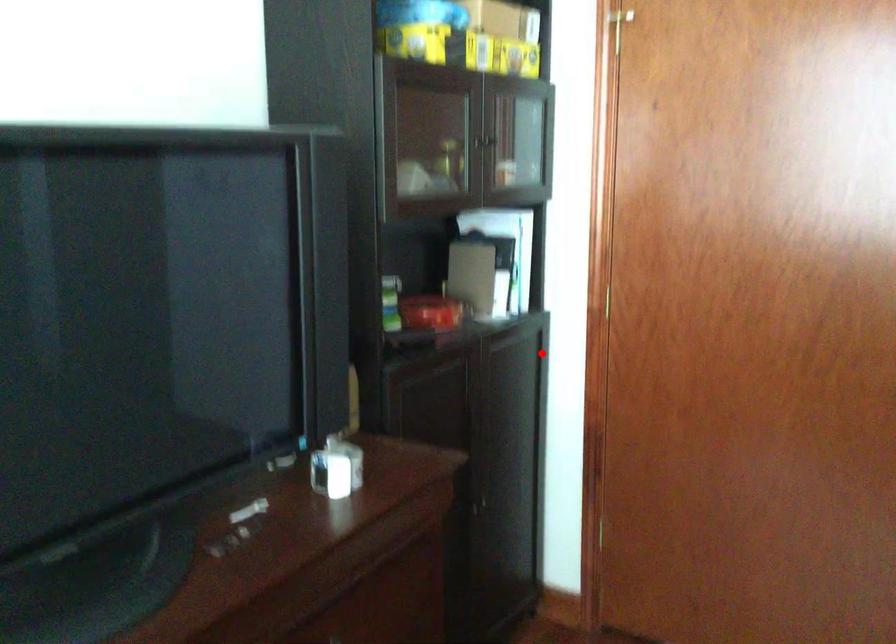
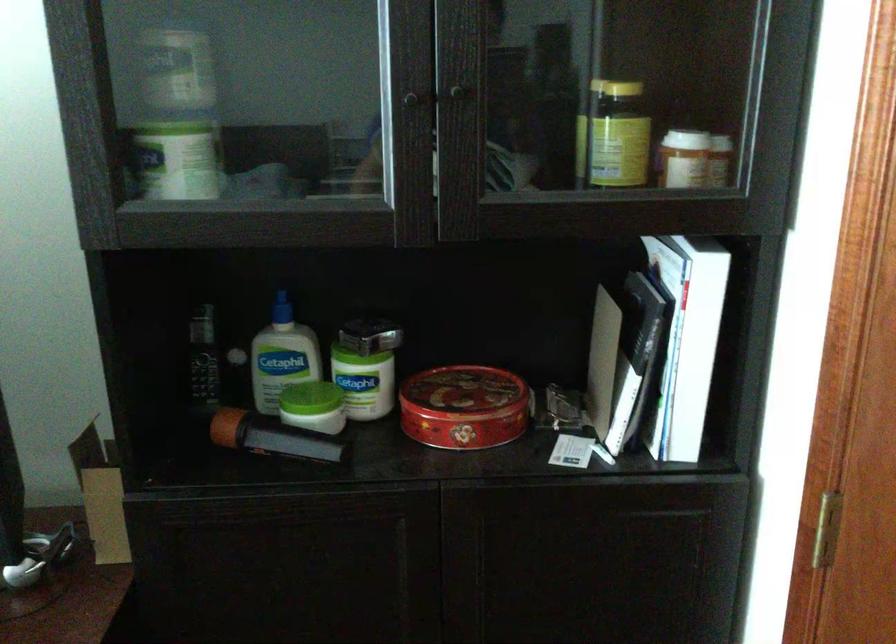
Question: I am providing you with two images of the same scene from different viewpoints. Given a red point in image1, look at the same physical point in image2. Is it:

Choices:
 (A) Closer to the viewpoint
 (B) Farther from the viewpoint

Answer: (A)